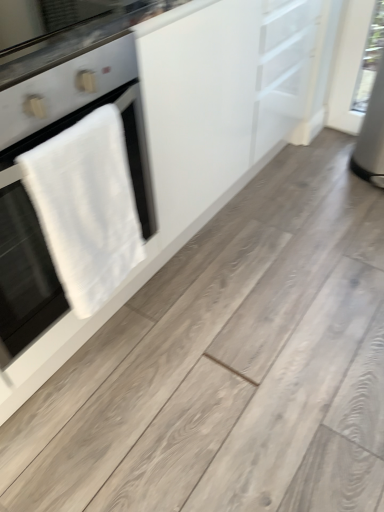
You are a GUI agent. You are given a task and a screenshot of the screen. Output one action in this format:
    pyautogui.click(x=<x>, y=<y>)
    Task: Click on the white matte cabinet at upper left
    The height and width of the screenshot is (512, 384).
    Given the screenshot: What is the action you would take?
    pyautogui.click(x=153, y=149)

From a real-world perspective, between white matte cabinet at upper left and black glass countertop at upper left, who is vertically lower?

white matte cabinet at upper left is physically lower.

Considering the sizes of objects white matte cabinet at upper left and black glass countertop at upper left in the image provided, who is smaller, white matte cabinet at upper left or black glass countertop at upper left?

black glass countertop at upper left.

Which is more to the left, white matte cabinet at upper left or black glass countertop at upper left?

black glass countertop at upper left is more to the left.

How many degrees apart are the facing directions of white matte cabinet at upper left and black glass countertop at upper left?

0.158 degrees separate the facing orientations of white matte cabinet at upper left and black glass countertop at upper left.

Is point (8, 348) positioned after point (122, 284)?

No, it is in front of (122, 284).

Considering the relative positions of white towel at left and white matte cabinet at upper left in the image provided, is white towel at left to the right of white matte cabinet at upper left from the viewer's perspective?

In fact, white towel at left is to the left of white matte cabinet at upper left.

Is white towel at left turned away from white matte cabinet at upper left?

No, white matte cabinet at upper left is not at the back of white towel at left.

Based on the photo, which object is thinner, white towel at left or white matte cabinet at upper left?

white towel at left.

From the picture: From the image's perspective, does black glass countertop at upper left appear higher than white matte cabinet at upper left?

Yes, from the image's perspective, black glass countertop at upper left is on top of white matte cabinet at upper left.

From a real-world perspective, is black glass countertop at upper left on white matte cabinet at upper left?

Yes, from a real-world perspective, black glass countertop at upper left is over white matte cabinet at upper left

Is black glass countertop at upper left in contact with white matte cabinet at upper left?

black glass countertop at upper left and white matte cabinet at upper left are clearly separated.

Considering the relative positions of black glass countertop at upper left and white matte cabinet at upper left in the image provided, is black glass countertop at upper left to the right of white matte cabinet at upper left from the viewer's perspective?

No.

Is white towel at left facing away from black glass countertop at upper left?

No.

Is white towel at left to the left of black glass countertop at upper left from the viewer's perspective?

Yes, white towel at left is to the left of black glass countertop at upper left.

Considering the positions of objects white towel at left and black glass countertop at upper left in the image provided, who is in front, white towel at left or black glass countertop at upper left?

white towel at left is in front.

Is point (60, 73) closer to viewer compared to point (80, 117)?

Yes.

How distant is white matte cabinet at upper left from white towel at left?

They are 9.03 inches apart.

Looking at this image, from a real-world perspective, is white matte cabinet at upper left located higher than white towel at left?

Actually, white matte cabinet at upper left is physically below white towel at left in the real world.

Is white matte cabinet at upper left next to white towel at left?

No, white matte cabinet at upper left is not making contact with white towel at left.

In the scene shown: Is black glass countertop at upper left beside white towel at left?

No, black glass countertop at upper left is not in contact with white towel at left.

Considering the sizes of objects black glass countertop at upper left and white towel at left in the image provided, who is taller, black glass countertop at upper left or white towel at left?

With more height is white towel at left.

Considering the sizes of black glass countertop at upper left and white towel at left in the image, is black glass countertop at upper left wider or thinner than white towel at left?

Clearly, black glass countertop at upper left has less width compared to white towel at left.

What's the angular difference between black glass countertop at upper left and white towel at left's facing directions?

0.635 degrees.

Where is `countertop on the left of white matte cabinet at upper left`? This screenshot has width=384, height=512. countertop on the left of white matte cabinet at upper left is located at coordinates (75, 41).

You are a GUI agent. You are given a task and a screenshot of the screen. Output one action in this format:
    pyautogui.click(x=<x>, y=<y>)
    Task: Click on the home appliance in front of the white matte cabinet at upper left
    This screenshot has width=384, height=512.
    Given the screenshot: What is the action you would take?
    pyautogui.click(x=80, y=111)

Considering their positions, is white towel at left positioned closer to black glass countertop at upper left than white matte cabinet at upper left?

white towel at left is positioned closer to the anchor black glass countertop at upper left.

Looking at the image, which one is located further to white towel at left, black glass countertop at upper left or white matte cabinet at upper left?

white matte cabinet at upper left is further to white towel at left.

Based on their spatial positions, is black glass countertop at upper left or white towel at left closer to white matte cabinet at upper left?

The object closer to white matte cabinet at upper left is white towel at left.

Which object lies nearer to the anchor point black glass countertop at upper left, white matte cabinet at upper left or white towel at left?

white towel at left is positioned closer to the anchor black glass countertop at upper left.

Which object lies nearer to the anchor point white matte cabinet at upper left, white towel at left or black glass countertop at upper left?

Based on the image, white towel at left appears to be nearer to white matte cabinet at upper left.

Looking at the image, which one is located further to white towel at left, white matte cabinet at upper left or black glass countertop at upper left?

Based on the image, white matte cabinet at upper left appears to be further to white towel at left.

Identify the location of countertop between white towel at left and white matte cabinet at upper left in the horizontal direction. (75, 41).